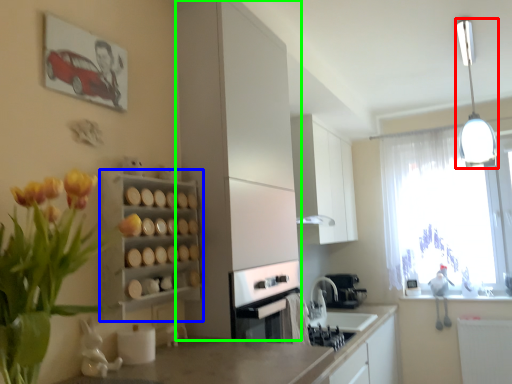
Question: Which object is the farthest from light fixture (highlighted by a red box)? Choose among these: shelf (highlighted by a blue box) or cabinetry (highlighted by a green box).

Choices:
 (A) shelf
 (B) cabinetry

Answer: (A)